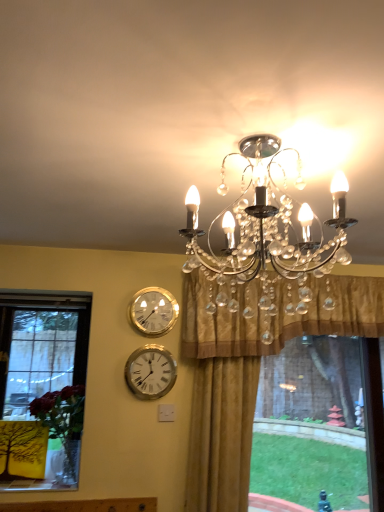
Question: Which direction should I rotate to face white metallic clock at center, marked as the 1th wall clock in a bottom-to-top arrangement, — up or down?

Choices:
 (A) down
 (B) up

Answer: (A)

Question: Could you tell me if clear crystal chandelier at upper center is facing gold satin curtain at upper center?

Choices:
 (A) yes
 (B) no

Answer: (B)

Question: Is clear crystal chandelier at upper center positioned before gold satin curtain at upper center?

Choices:
 (A) yes
 (B) no

Answer: (A)

Question: From the image's perspective, is clear crystal chandelier at upper center on top of gold satin curtain at upper center?

Choices:
 (A) yes
 (B) no

Answer: (A)

Question: Can you confirm if clear crystal chandelier at upper center is bigger than gold satin curtain at upper center?

Choices:
 (A) no
 (B) yes

Answer: (A)

Question: Can you confirm if clear crystal chandelier at upper center is thinner than gold satin curtain at upper center?

Choices:
 (A) no
 (B) yes

Answer: (A)

Question: Can gold satin curtain at upper center be found inside clear crystal chandelier at upper center?

Choices:
 (A) yes
 (B) no

Answer: (B)

Question: Can you confirm if white metallic clock at center, marked as the 1th wall clock in a bottom-to-top arrangement, is positioned to the left of clear crystal chandelier at upper center?

Choices:
 (A) no
 (B) yes

Answer: (B)

Question: Are white metallic clock at center, marked as the 1th wall clock in a bottom-to-top arrangement, and clear crystal chandelier at upper center beside each other?

Choices:
 (A) no
 (B) yes

Answer: (A)

Question: Considering the relative sizes of white metallic clock at center, marked as the second wall clock in a top-to-bottom arrangement, and clear crystal chandelier at upper center in the image provided, is white metallic clock at center, marked as the second wall clock in a top-to-bottom arrangement, thinner than clear crystal chandelier at upper center?

Choices:
 (A) yes
 (B) no

Answer: (A)

Question: From a real-world perspective, does white metallic clock at center, marked as the second wall clock in a top-to-bottom arrangement, stand above clear crystal chandelier at upper center?

Choices:
 (A) yes
 (B) no

Answer: (B)

Question: From the image's perspective, is white metallic clock at center, marked as the 1th wall clock in a bottom-to-top arrangement, located beneath clear crystal chandelier at upper center?

Choices:
 (A) yes
 (B) no

Answer: (A)

Question: Can you confirm if white metallic clock at center, marked as the 1th wall clock in a bottom-to-top arrangement, is shorter than clear crystal chandelier at upper center?

Choices:
 (A) yes
 (B) no

Answer: (A)

Question: Is gold metallic wall clock at upper center, which is the first wall clock in top-to-bottom order, not inside gold satin curtain at upper center?

Choices:
 (A) yes
 (B) no

Answer: (A)